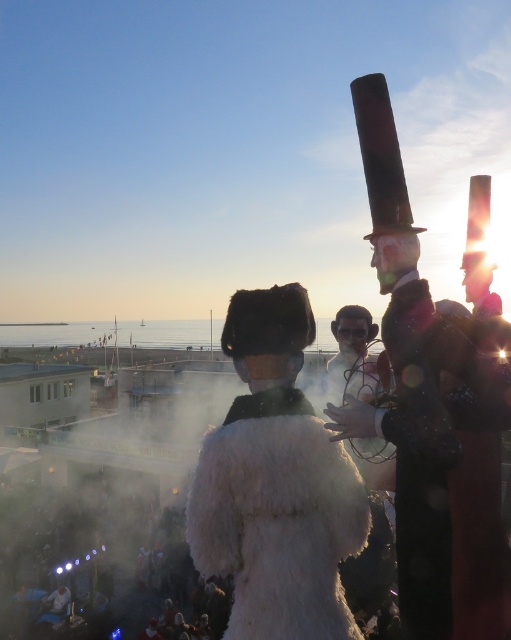
Question: In this image, where is shiny black suit at center located relative to white fluffy coat at center?

Choices:
 (A) above
 (B) below

Answer: (A)

Question: Which point appears closest to the camera in this image?

Choices:
 (A) (265, 433)
 (B) (484, 621)

Answer: (A)

Question: Can you confirm if shiny black suit at center is positioned above white fluffy coat at center?

Choices:
 (A) yes
 (B) no

Answer: (A)

Question: Does shiny black suit at center come behind white fluffy coat at center?

Choices:
 (A) yes
 (B) no

Answer: (B)